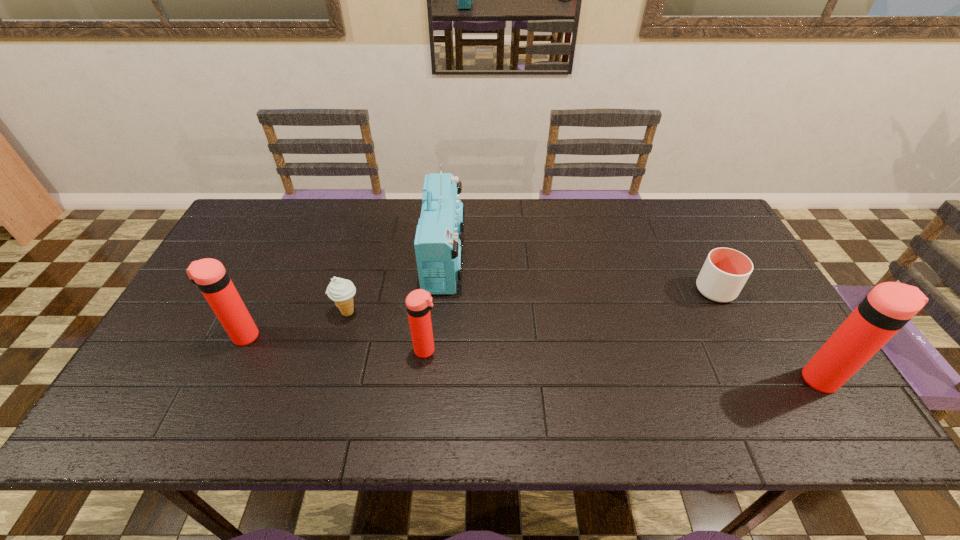
Locate an element on the screen. cup that is at the right edge is located at coordinates (725, 271).

Locate an element on the screen. The height and width of the screenshot is (540, 960). object at the near right corner is located at coordinates (889, 306).

Identify the location of free spot at the far edge of the desktop. The image size is (960, 540). (357, 226).

Locate an element on the screen. free space at the near edge is located at coordinates (514, 389).

What are the coordinates of `vacant region at the left edge of the desktop` in the screenshot? It's located at (269, 247).

Identify the location of free space at the right edge of the desktop. (754, 286).

At what (x,y) coordinates should I click in order to perform the action: click on free space at the near left corner of the desktop. Please return your answer as a coordinate pair (x, y). The width and height of the screenshot is (960, 540). Looking at the image, I should click on (207, 372).

Find the location of `vacant space that's between the rightmost object and the shortest thermos bottle`. vacant space that's between the rightmost object and the shortest thermos bottle is located at coordinates (624, 364).

What are the coordinates of `free space between the radio receiver and the shortest thermos bottle` in the screenshot? It's located at (436, 303).

Image resolution: width=960 pixels, height=540 pixels. What are the coordinates of `free space between the cup and the fifth object from right to left` in the screenshot? It's located at pyautogui.click(x=532, y=301).